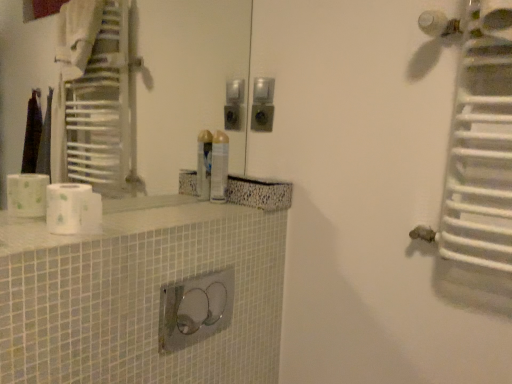
Question: Is white matte toilet paper at left to the left or to the right of metallic silver spray can at center in the image?

Choices:
 (A) left
 (B) right

Answer: (A)

Question: From the image's perspective, is white matte toilet paper at left positioned above or below metallic silver spray can at center?

Choices:
 (A) above
 (B) below

Answer: (B)

Question: Which is farther from the white metallic radiator at upper right?

Choices:
 (A) white matte toilet paper at left
 (B) white glossy counter top at center
 (C) metallic silver spray can at center

Answer: (A)

Question: Which object is positioned closest to the metallic silver spray can at center?

Choices:
 (A) white metallic radiator at upper right
 (B) white matte toilet paper at left
 (C) white glossy counter top at center

Answer: (C)